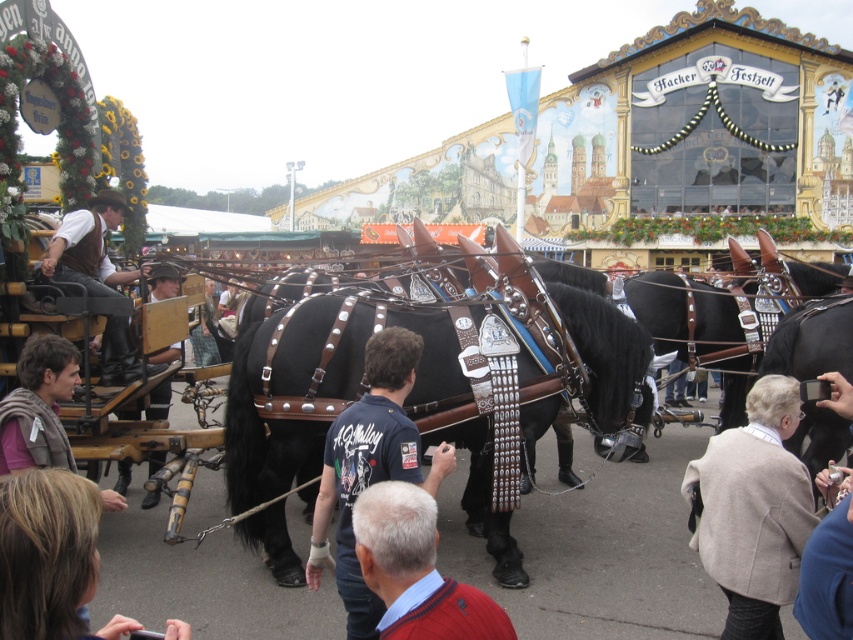
Question: In this image, where is beige wool sweater at lower right located relative to red sweater at lower center?

Choices:
 (A) below
 (B) above

Answer: (B)

Question: Which is nearer to the leather hat at center?

Choices:
 (A) shiny black horse at center
 (B) brown leather jacket at left
 (C) red sweater at lower center
 (D) beige wool sweater at lower right

Answer: (B)

Question: Which point is closer to the camera taking this photo?

Choices:
 (A) (76, 259)
 (B) (334, 576)
 (C) (256, 369)

Answer: (B)

Question: Does beige wool sweater at lower right have a larger size compared to red sweater at lower center?

Choices:
 (A) no
 (B) yes

Answer: (B)

Question: Which point appears closest to the camera in this image?

Choices:
 (A) (582, 330)
 (B) (64, 244)
 (C) (138, 412)

Answer: (A)

Question: Does shiny black horse at center have a greater width compared to red sweater at lower center?

Choices:
 (A) yes
 (B) no

Answer: (A)